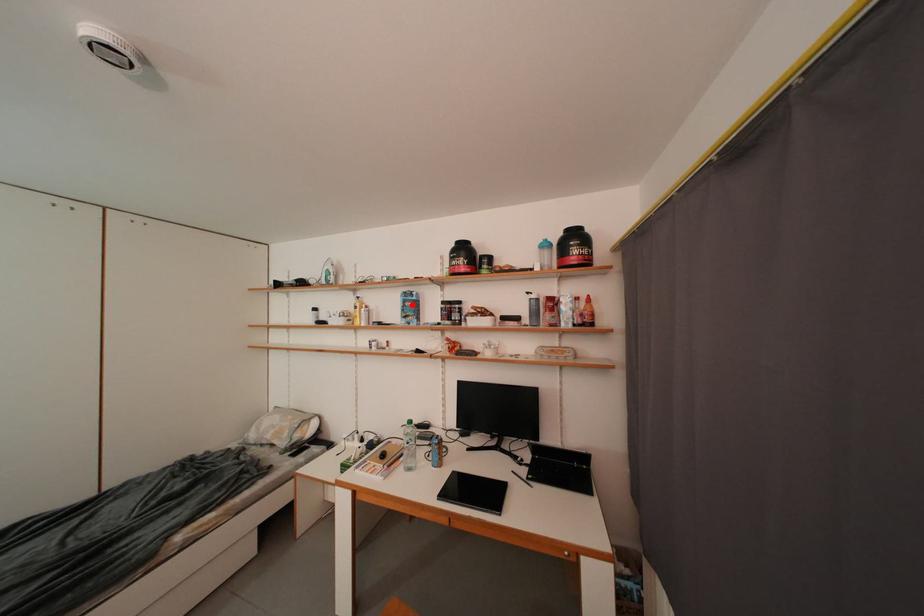
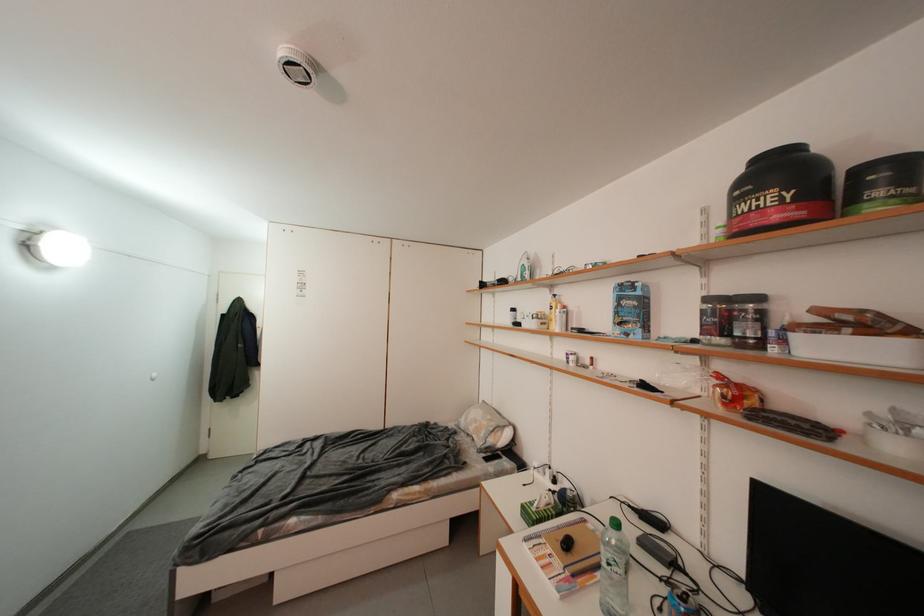
Where in the second image is the point corresponding to the highlighted location from the first image?

(627, 302)